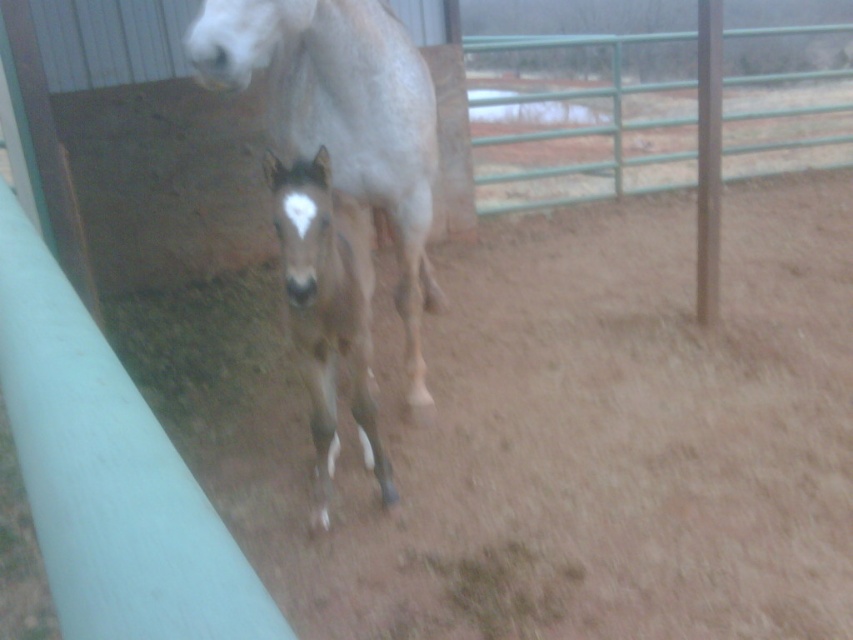
Question: Which point appears closest to the camera in this image?

Choices:
 (A) (357, 332)
 (B) (285, 113)

Answer: (A)

Question: Does brown matte horse at center appear over brown speckled coat at center?

Choices:
 (A) yes
 (B) no

Answer: (A)

Question: Does brown matte horse at center have a larger size compared to brown speckled coat at center?

Choices:
 (A) yes
 (B) no

Answer: (A)

Question: Which point appears closest to the camera in this image?

Choices:
 (A) (302, 240)
 (B) (347, 156)

Answer: (A)

Question: Is brown matte horse at center to the right of brown speckled coat at center from the viewer's perspective?

Choices:
 (A) yes
 (B) no

Answer: (B)